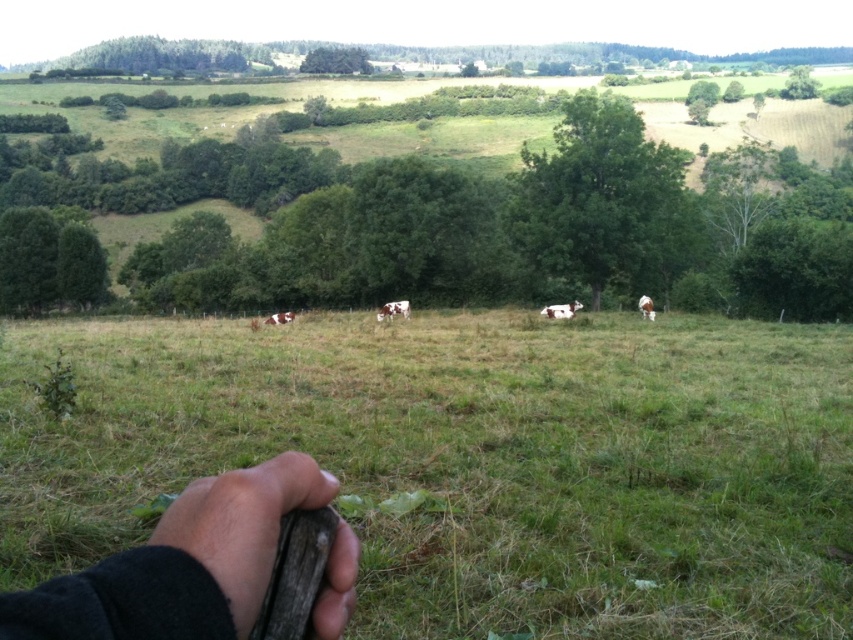
You are standing in a rural area and see a green grassy field at center and a brown speckled cow at right. Which object is positioned to the left of the other?

The green grassy field at center is to the left of the brown speckled cow at right according to the description.